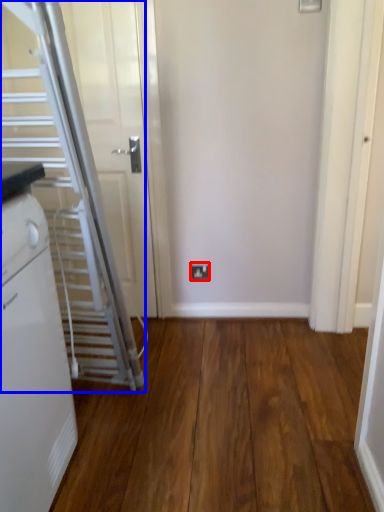
Question: Among these objects, which one is nearest to the camera, electric outlet (highlighted by a red box) or escalator (highlighted by a blue box)?

Choices:
 (A) electric outlet
 (B) escalator

Answer: (B)